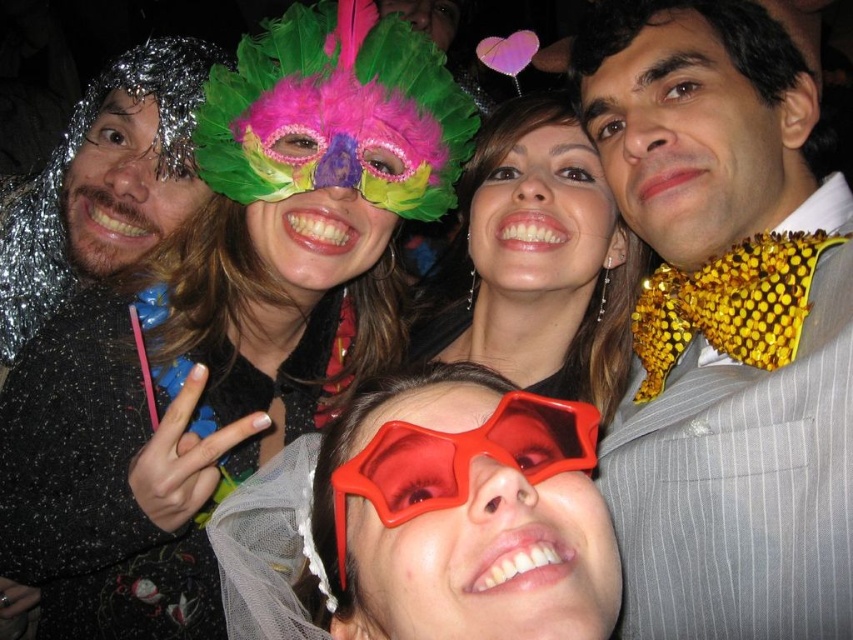
You are at a party and want to take a photo with the feathered mask at upper center and the transparent plastic glasses at center. Since you need to focus on both objects in your camera, which one should you adjust your focus towards first?

The feathered mask at upper center is located above transparent plastic glasses at center, so you should focus on the feathered mask at upper center first as it is closer to the camera.

You are a photographer at the event and want to ensure the shiny gold bow tie at center and the matte black dress at center are both visible in your photo. Given their sizes, which one might you need to adjust your camera angle to focus on more carefully?

The shiny gold bow tie at center is much taller than the matte black dress at center, so you might need to adjust your camera angle to focus more carefully on the shiny gold bow tie at center to ensure it doesn